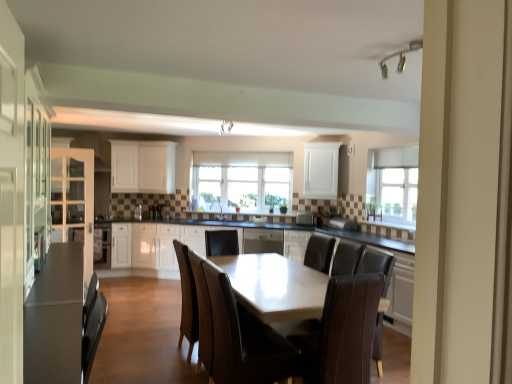
Question: Could you tell me if matte white cabinet at left, marked as the 5th cabinetry in a right-to-left arrangement, is turned towards matte white table at center?

Choices:
 (A) yes
 (B) no

Answer: (B)

Question: Is matte white cabinet at left, the first cabinetry from the left, to the right of matte white table at center from the viewer's perspective?

Choices:
 (A) yes
 (B) no

Answer: (B)

Question: From a real-world perspective, is matte white cabinet at left, the first cabinetry from the left, over matte white table at center?

Choices:
 (A) yes
 (B) no

Answer: (A)

Question: From the image's perspective, is matte white cabinet at left, marked as the 5th cabinetry in a right-to-left arrangement, under matte white table at center?

Choices:
 (A) yes
 (B) no

Answer: (B)

Question: Is matte white cabinet at left, the first cabinetry from the left, next to matte white table at center and touching it?

Choices:
 (A) no
 (B) yes

Answer: (A)

Question: From a real-world perspective, is satin silver toaster at center, marked as the 2th appliance in a right-to-left arrangement, physically located above or below white glossy sink at center?

Choices:
 (A) above
 (B) below

Answer: (B)

Question: Considering the positions of point (140, 210) and point (223, 218), is point (140, 210) closer or farther from the camera than point (223, 218)?

Choices:
 (A) closer
 (B) farther

Answer: (B)

Question: Considering the relative positions of satin silver toaster at center, the 1th appliance when ordered from left to right, and white glossy sink at center in the image provided, is satin silver toaster at center, the 1th appliance when ordered from left to right, to the left or to the right of white glossy sink at center?

Choices:
 (A) right
 (B) left

Answer: (B)

Question: Which is correct: satin silver toaster at center, marked as the 2th appliance in a right-to-left arrangement, is inside white glossy sink at center, or outside of it?

Choices:
 (A) outside
 (B) inside

Answer: (A)

Question: Looking at the image, does white glossy sink at center seem bigger or smaller compared to satin silver dishwasher at center?

Choices:
 (A) small
 (B) big

Answer: (A)

Question: From their relative heights in the image, would you say white glossy sink at center is taller or shorter than satin silver dishwasher at center?

Choices:
 (A) short
 (B) tall

Answer: (A)

Question: Relative to satin silver dishwasher at center, is white glossy sink at center in front or behind?

Choices:
 (A) front
 (B) behind

Answer: (B)

Question: From a real-world perspective, is white glossy sink at center above or below satin silver dishwasher at center?

Choices:
 (A) below
 (B) above

Answer: (B)

Question: Would you say white glossy cabinet at center, the 4th cabinetry from the left, is inside or outside white matte cabinet at center, acting as the 4th cabinetry starting from the right?

Choices:
 (A) outside
 (B) inside

Answer: (A)

Question: Is white glossy cabinet at center, placed as the 2th cabinetry when sorted from right to left, wider or thinner than white matte cabinet at center, which is the second cabinetry in left-to-right order?

Choices:
 (A) thin
 (B) wide

Answer: (B)